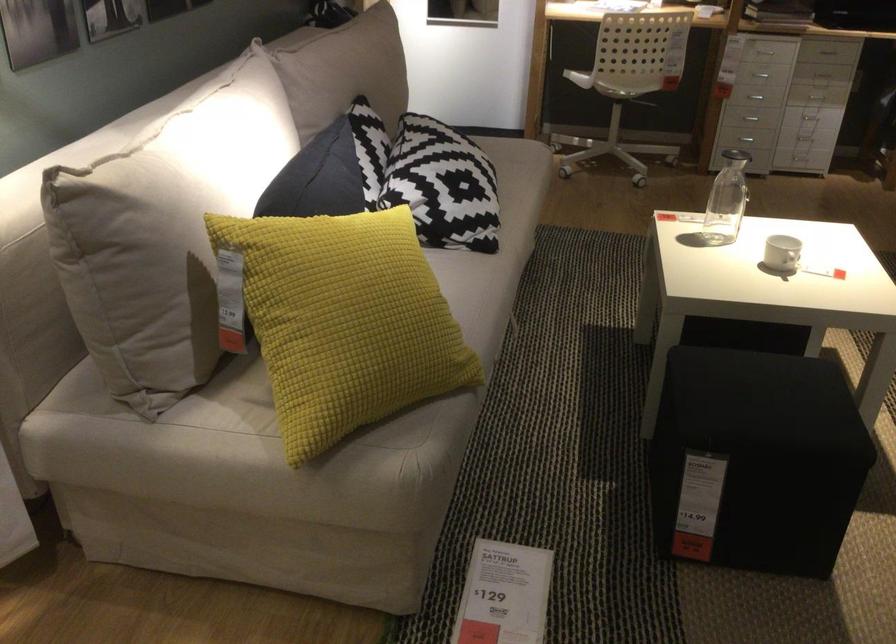
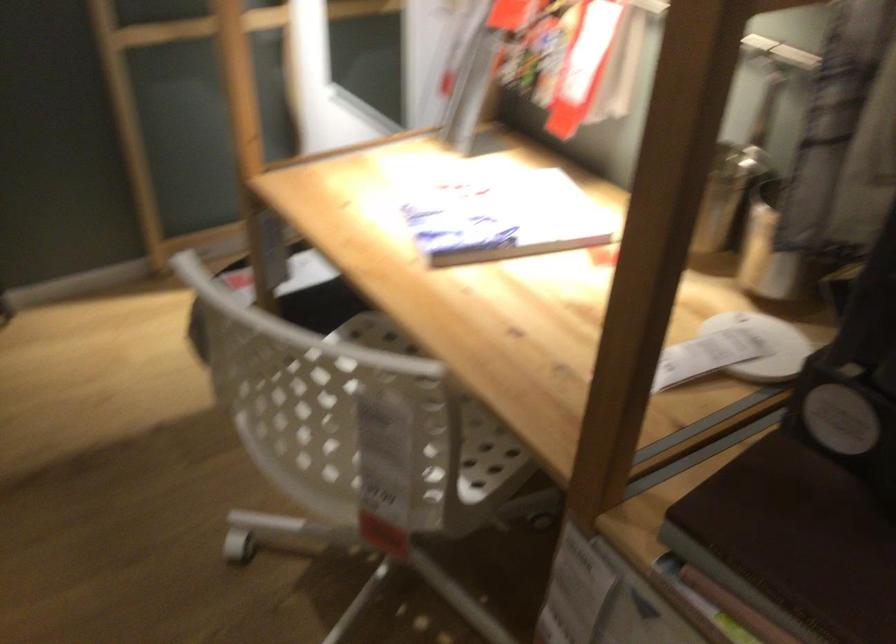
Question: I am providing you with two images of the same scene from different viewpoints. Please identify which objects are invisible in image2.

Choices:
 (A) metal shaker cup
 (B) chair sitting surface
 (C) dark brown book
 (D) black trash can pedal

Answer: (B)